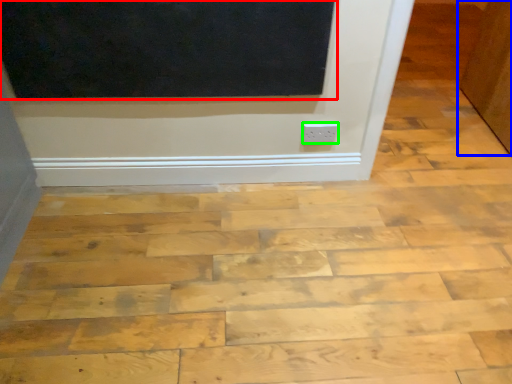
Question: Considering the real-world distances, which object is closest to screen door (highlighted by a red box)? door (highlighted by a blue box) or electric outlet (highlighted by a green box).

Choices:
 (A) door
 (B) electric outlet

Answer: (B)